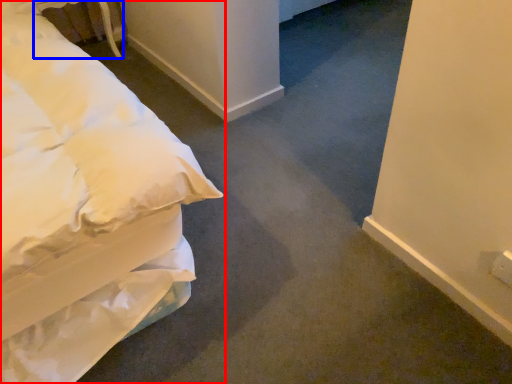
Question: Which point is further to the camera, bed (highlighted by a red box) or table (highlighted by a blue box)?

Choices:
 (A) bed
 (B) table

Answer: (B)